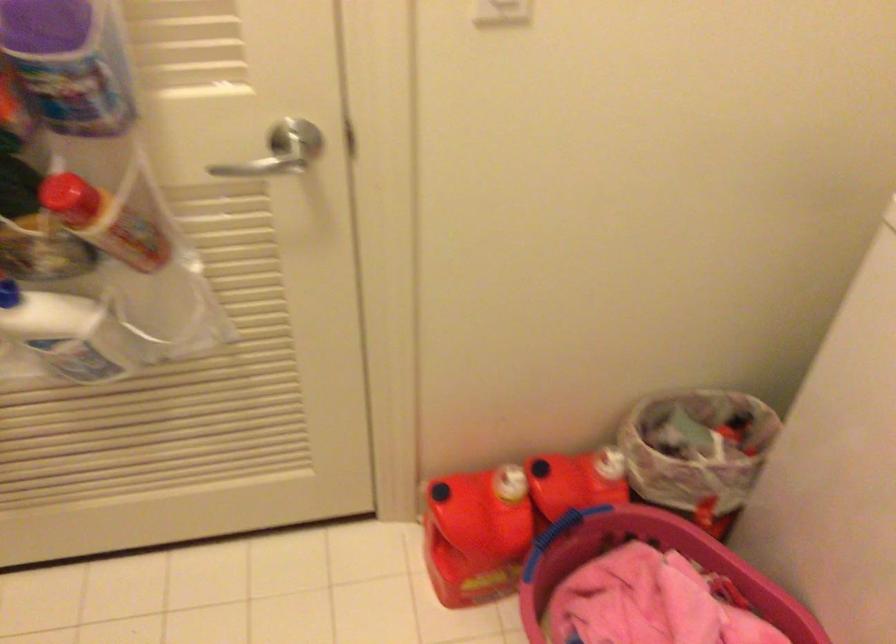
This screenshot has width=896, height=644. What are the coordinates of `silver door handle` in the screenshot? It's located at (283, 137).